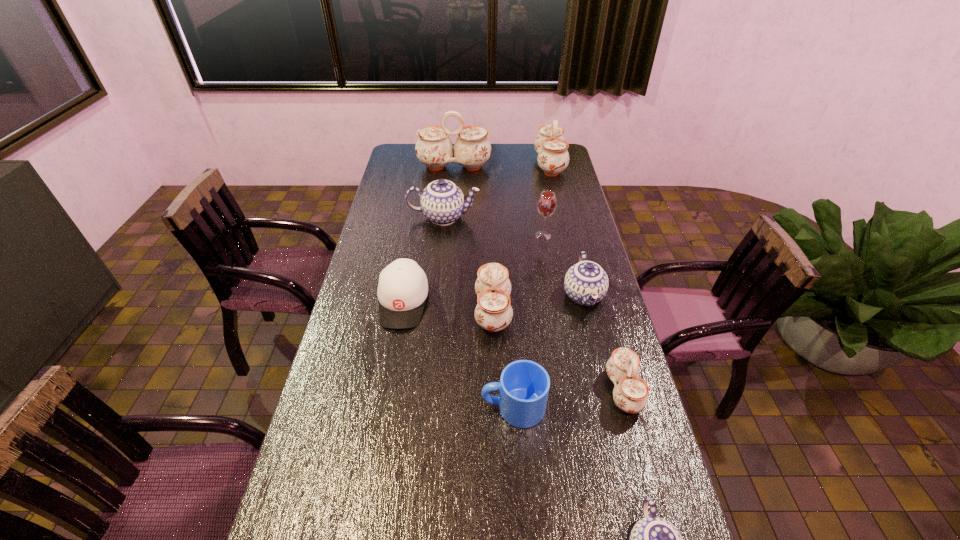
Identify which white chinaware is the second nearest to the shortest chinaware. Please provide its 2D coordinates. Your answer should be formatted as a tuple, i.e. [(x, y)], where the tuple contains the x and y coordinates of a point satisfying the conditions above.

[(493, 312)]

Locate which blue chinaware ranks second in proximity to the red wineglass. Please provide its 2D coordinates. Your answer should be formatted as a tuple, i.e. [(x, y)], where the tuple contains the x and y coordinates of a point satisfying the conditions above.

[(442, 202)]

Find the location of `the third closest blue chinaware relative to the second smallest white chinaware`. the third closest blue chinaware relative to the second smallest white chinaware is located at coordinates (653, 539).

Find the location of a particular element. The image size is (960, 540). free point that satisfies the following two spatial constraints: 1. by the handle of the fourth farthest object; 2. on the right side of the tallest chinaware is located at coordinates coord(448,236).

Where is `vacant space that satisfies the following two spatial constraints: 1. by the handle of the second tallest chinaware; 2. by the handle of the tallest object`? vacant space that satisfies the following two spatial constraints: 1. by the handle of the second tallest chinaware; 2. by the handle of the tallest object is located at coordinates (550, 166).

This screenshot has height=540, width=960. I want to click on free space that satisfies the following two spatial constraints: 1. by the handle of the tallest object; 2. at the spout of the biggest blue chinaware, so click(450, 217).